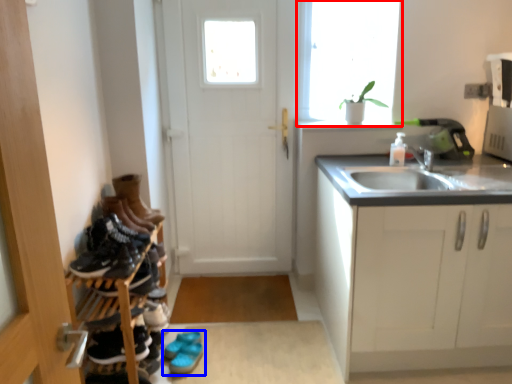
Question: Among these objects, which one is farthest to the camera, window (highlighted by a red box) or footwear (highlighted by a blue box)?

Choices:
 (A) window
 (B) footwear

Answer: (A)